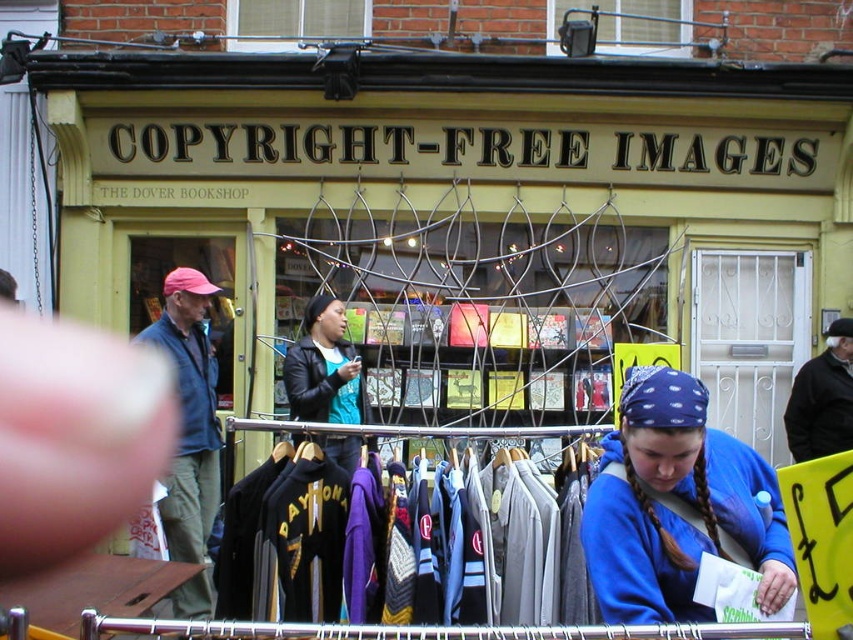
You are a delivery person with a box that is 1.5 meters wide. You need to place the box between the metallic wire mesh at center and the black leather jacket at upper right. Is there enough space to fit the box without overlapping either object?

The metallic wire mesh at center and the black leather jacket at upper right are 1.61 meters apart. Since the box is 1.5 meters wide, there is enough space to fit it between them without overlapping either object.

You are a delivery person standing in front of the shop. You need to place a large box that is 2 feet wide in the space between the metallic wire mesh at center and the shop window. Is there enough space for the box?

The metallic wire mesh at center is 22.72 feet away from the viewer. Since the box is only 2 feet wide, there is ample space between the metallic wire mesh at center and the shop window to accommodate the box.

You are a customer looking at the clothing rack in front of the shop. You see a leather jacket at center and a black leather jacket at upper right. Which jacket is positioned to the left of the other?

The leather jacket at center is positioned to the left of the black leather jacket at upper right.